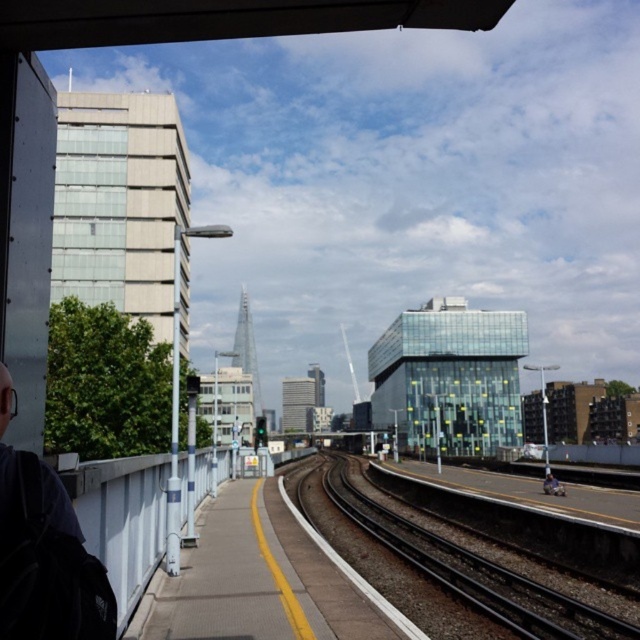
You are a photographer trying to capture both the dark gray backpack at left and the light blue denim jacket at lower right in a single shot. Based on their sizes, which object should you focus on first to ensure both fit in the frame?

Since the dark gray backpack at left is narrower than the light blue denim jacket at lower right, you should focus on positioning the light blue denim jacket at lower right first to ensure both fit in the frame.